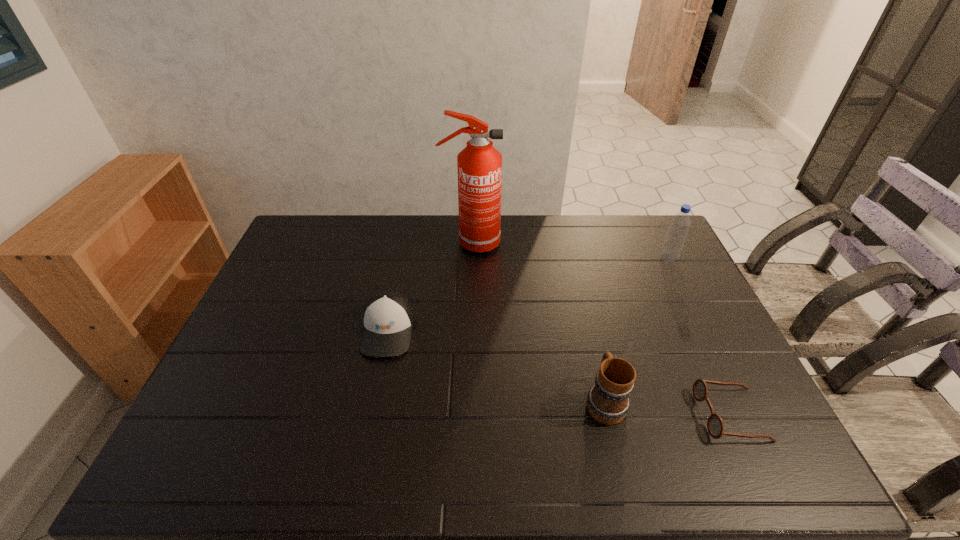
The image size is (960, 540). I want to click on free space between the third farthest object and the spectacles, so (x=560, y=373).

At what (x,y) coordinates should I click in order to perform the action: click on vacant area between the mug and the spectacles. Please return your answer as a coordinate pair (x, y). Image resolution: width=960 pixels, height=540 pixels. Looking at the image, I should click on (667, 408).

I want to click on free spot between the shortest object and the second tallest object, so click(700, 336).

At what (x,y) coordinates should I click in order to perform the action: click on empty location between the fourth shortest object and the third object from left to right. Please return your answer as a coordinate pair (x, y). The width and height of the screenshot is (960, 540). Looking at the image, I should click on (636, 329).

The image size is (960, 540). In order to click on free space between the leftmost object and the bottle in this screenshot , I will do `click(528, 294)`.

Where is `unoccupied position between the third shortest object and the bottle`? The height and width of the screenshot is (540, 960). unoccupied position between the third shortest object and the bottle is located at coordinates (636, 329).

At what (x,y) coordinates should I click in order to perform the action: click on vacant area that lies between the third farthest object and the tallest object. Please return your answer as a coordinate pair (x, y). This screenshot has height=540, width=960. Looking at the image, I should click on (429, 287).

Find the location of a particular element. The image size is (960, 540). free point between the mug and the shortest object is located at coordinates (667, 408).

Identify the location of unoccupied position between the spectacles and the mug. (667, 408).

Identify which object is located as the third nearest to the leftmost object. Please provide its 2D coordinates. Your answer should be formatted as a tuple, i.e. [(x, y)], where the tuple contains the x and y coordinates of a point satisfying the conditions above.

[(715, 425)]